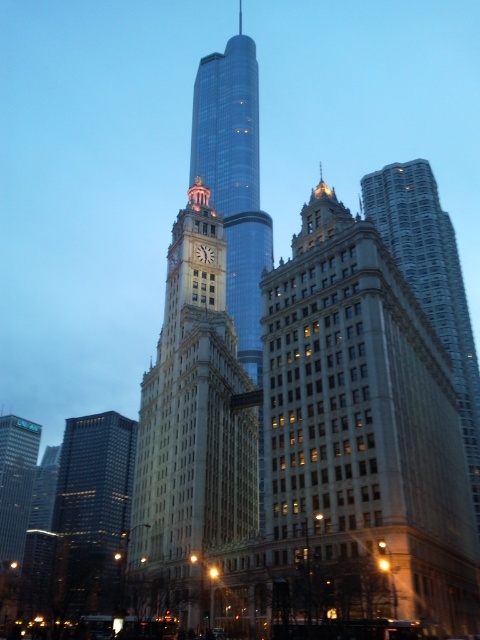
Question: Considering the real-world distances, which object is farthest from the shiny glass skyscraper at center?

Choices:
 (A) gold/brass/ornate clock tower at center
 (B) matte silver clock at center
 (C) dark glass skyscraper at left

Answer: (C)

Question: Can you confirm if shiny glass skyscraper at center is positioned below dark glass skyscraper at left?

Choices:
 (A) yes
 (B) no

Answer: (B)

Question: Does shiny glass skyscraper at center come in front of silver metallic skyscraper at center?

Choices:
 (A) no
 (B) yes

Answer: (A)

Question: Which point is closer to the camera taking this photo?

Choices:
 (A) (99, 502)
 (B) (136, 460)
 (C) (432, 323)
 (D) (204, 259)

Answer: (B)

Question: Does gold/brass/ornate clock tower at center lie behind shiny glass skyscraper at center?

Choices:
 (A) no
 (B) yes

Answer: (A)

Question: Which point is farther to the camera?

Choices:
 (A) gold/brass/ornate clock tower at center
 (B) matte silver clock at center
 (C) shiny glass skyscraper at center

Answer: (C)